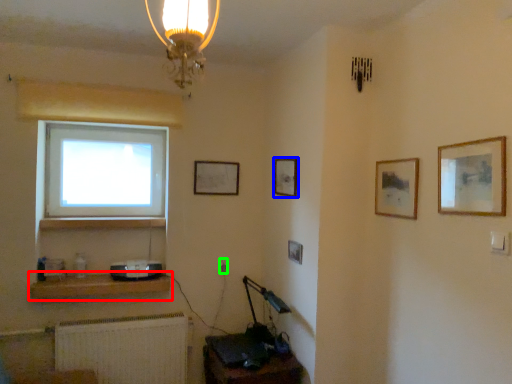
Question: Which object is the farthest from shelf (highlighted by a red box)? Choose among these: picture frame (highlighted by a blue box) or electric outlet (highlighted by a green box).

Choices:
 (A) picture frame
 (B) electric outlet

Answer: (A)